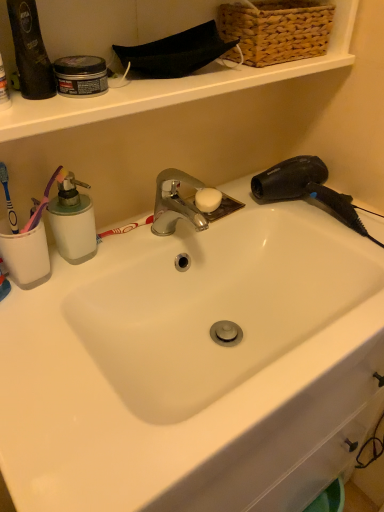
Question: Is black plastic hair dryer at upper right inside or outside of blue plastic toothbrush at left?

Choices:
 (A) inside
 (B) outside

Answer: (B)

Question: Looking at their shapes, would you say black plastic hair dryer at upper right is wider or thinner than blue plastic toothbrush at left?

Choices:
 (A) wide
 (B) thin

Answer: (A)

Question: Which object is positioned closest to the black plastic hair dryer at upper right?

Choices:
 (A) white plastic soap dispenser at left
 (B) white ceramic sink at center
 (C) blue plastic toothbrush at left
 (D) woven wicker basket at upper right

Answer: (D)

Question: Estimate the real-world distances between objects in this image. Which object is closer to the white plastic soap dispenser at left?

Choices:
 (A) blue plastic toothbrush at left
 (B) white ceramic sink at center
 (C) woven wicker basket at upper right
 (D) black plastic hair dryer at upper right

Answer: (A)